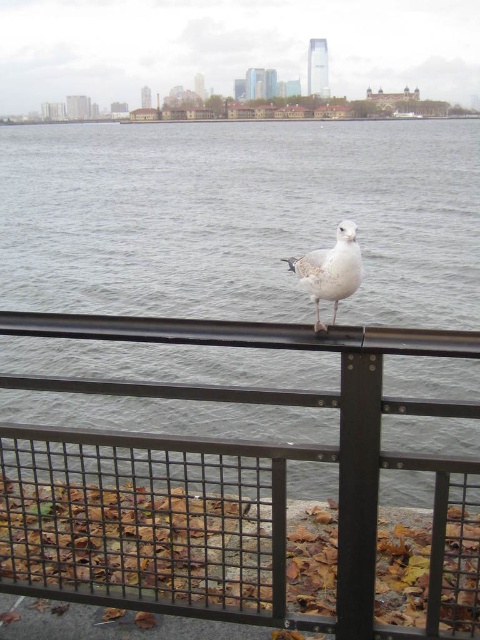
You are a photographer trying to capture a closeup of the white feathered bird at center. You notice the gray water at center is also in the frame. Which object takes up more space in the photo?

The gray water at center takes up more space in the photo because it is larger in size than the white feathered bird at center.

You are standing at the point marked as point (240,218) in the image. Based on the scene description, what is the color of the surface you are currently standing on?

The point (240,218) corresponds to gray water at center, so the surface is gray water.

You are standing at the position of the seagull on the metal railing. Looking out, where exactly is the gray water at center located in terms of coordinates?

The gray water at center is located at coordinates point (240, 218).